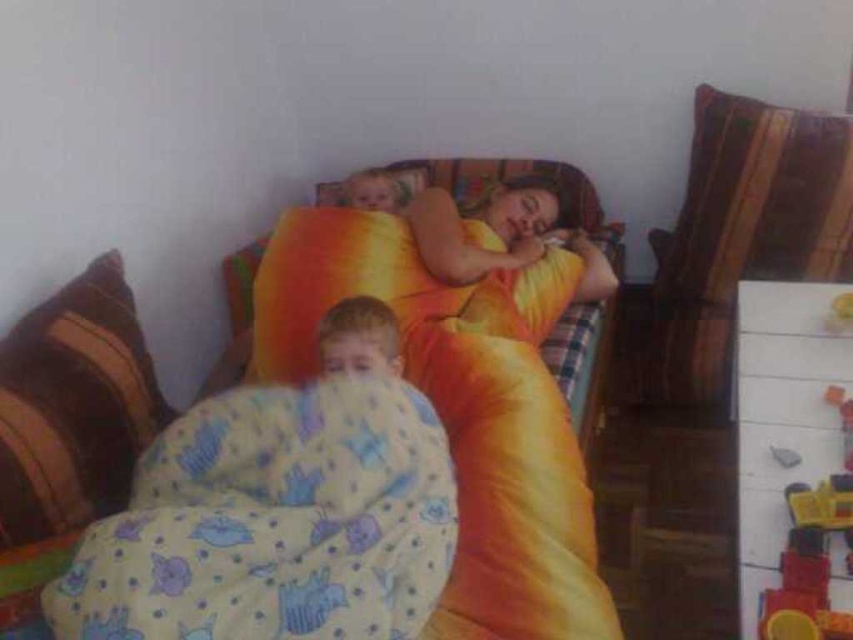
You are a person who wants to place a small book on the bed. Which object, the striped fabric pillow at left or the smooth yellow blanket at lower center, would be a more stable surface for the book?

The striped fabric pillow at left has a greater height compared to the smooth yellow blanket at lower center, so the striped fabric pillow at left would provide a more stable surface for the book.

You are a delivery robot that is 12 inches wide. You need to move from the yellow cotton blanket at lower left to the smooth yellow blanket at lower center. Is there enough space for you to pass through?

The distance between the yellow cotton blanket at lower left and the smooth yellow blanket at lower center is 11.69 inches. Since the robot is 12 inches wide, it cannot pass through the space between them as the distance is narrower than the robot.

You are designing a room layout and need to place a new nightstand next to the yellow satin bed at center. According to the coordinates provided, where should you place the nightstand relative to the bed?

The yellow satin bed at center is located at coordinates point (466, 392). To place the nightstand next to it, position it adjacent to these coordinates, ensuring it aligns with the bed.